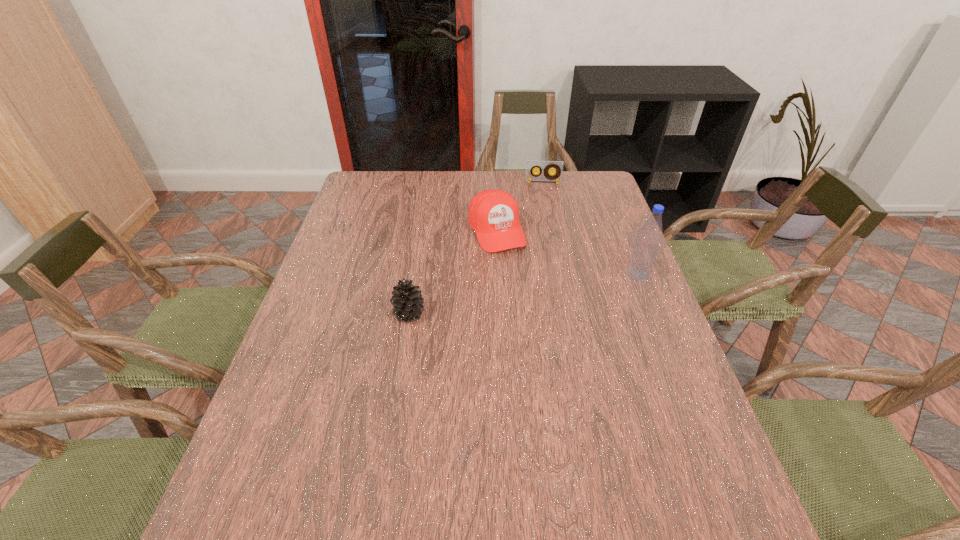
Locate an element on the screen. This screenshot has width=960, height=540. the leftmost object is located at coordinates (408, 302).

Locate an element on the screen. The width and height of the screenshot is (960, 540). pinecone is located at coordinates (408, 302).

This screenshot has width=960, height=540. I want to click on the third farthest object, so click(645, 251).

The image size is (960, 540). What are the coordinates of `the rightmost object` in the screenshot? It's located at (645, 251).

Locate an element on the screen. the third object from right to left is located at coordinates (493, 214).

Locate an element on the screen. The image size is (960, 540). the third nearest object is located at coordinates (493, 214).

Find the location of a particular element. the second object from right to left is located at coordinates (531, 165).

This screenshot has width=960, height=540. In order to click on the farthest object in this screenshot , I will do `click(531, 165)`.

This screenshot has height=540, width=960. Identify the location of vacant space located on the back of the leftmost object. (422, 229).

Identify the location of vacant area located on the back of the second nearest object. (619, 224).